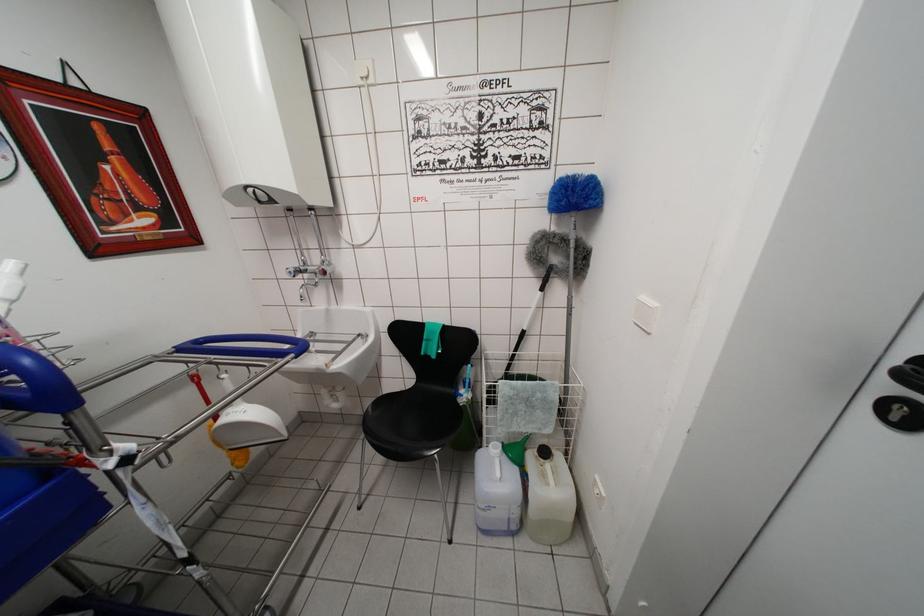
This screenshot has width=924, height=616. I want to click on black door handle, so click(900, 413).